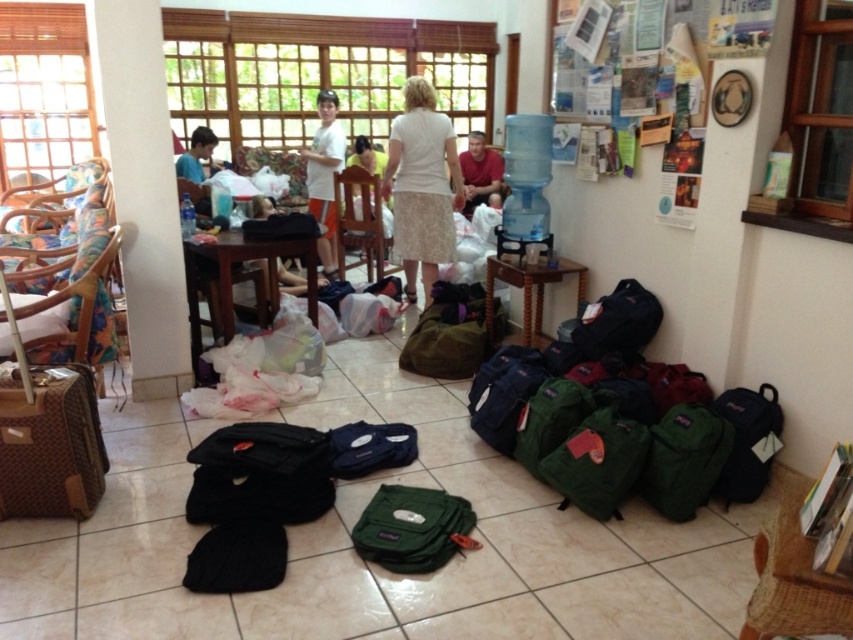
You are standing in the room and want to pick up the brown textured suitcase at left and the white textured skirt at center. Which object is closer to you?

The brown textured suitcase at left is closer to the viewer than the white textured skirt at center.

You are standing in the middle of the room and want to place a new item at the same location as the brown textured suitcase at left. What are the coordinates where you should place it?

The coordinates for the brown textured suitcase at left are at point (x=48, y=440), so you should place the new item at those coordinates.